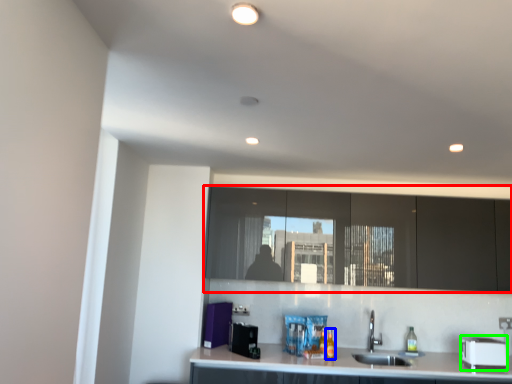
Question: Estimate the real-world distances between objects in this image. Which object is farther from cabinetry (highlighted by a red box), bottle (highlighted by a blue box) or appliance (highlighted by a green box)?

Choices:
 (A) bottle
 (B) appliance

Answer: (A)